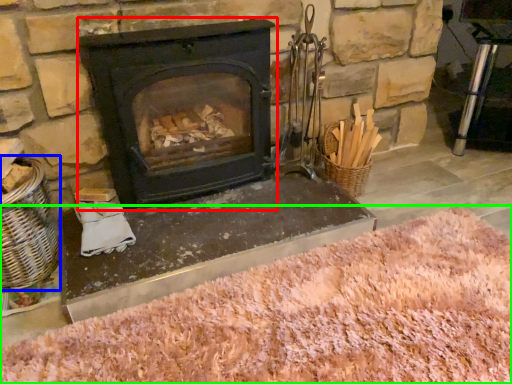
Question: Considering the real-world distances, which object is farthest from wood burning stove (highlighted by a red box)? basket (highlighted by a blue box) or sand (highlighted by a green box)?

Choices:
 (A) basket
 (B) sand

Answer: (B)